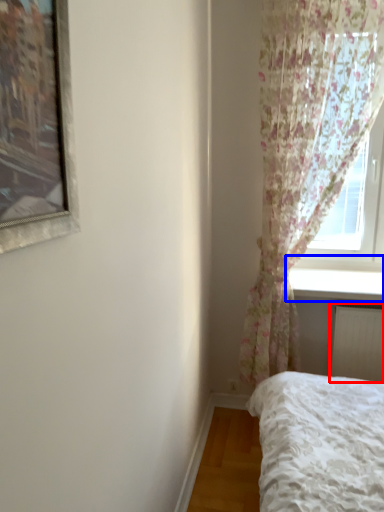
Question: Which object appears farthest to the camera in this image, radiator (highlighted by a red box) or window sill (highlighted by a blue box)?

Choices:
 (A) radiator
 (B) window sill

Answer: (A)